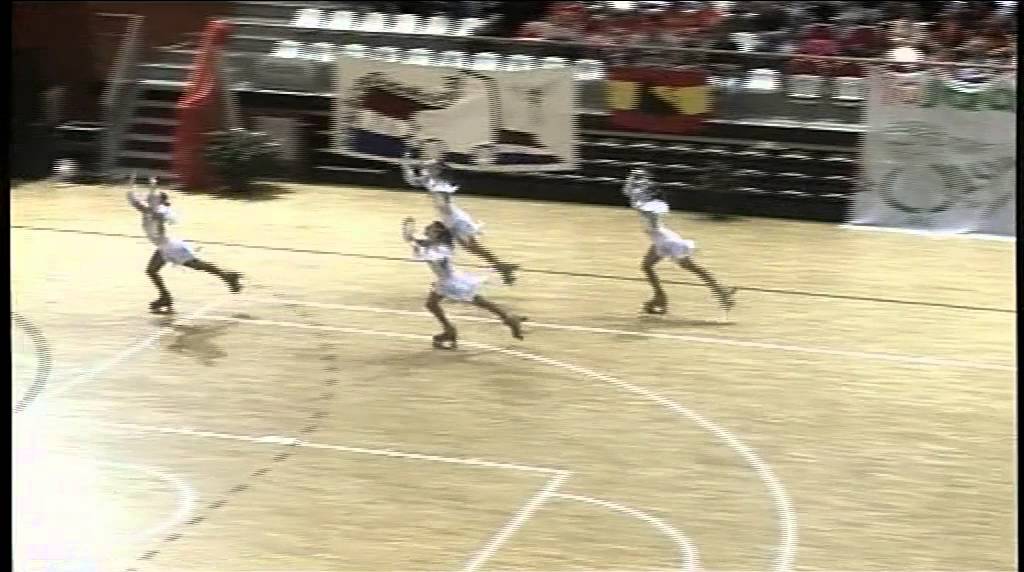
Locate an element on the screen. posters is located at coordinates (956, 138), (469, 98).